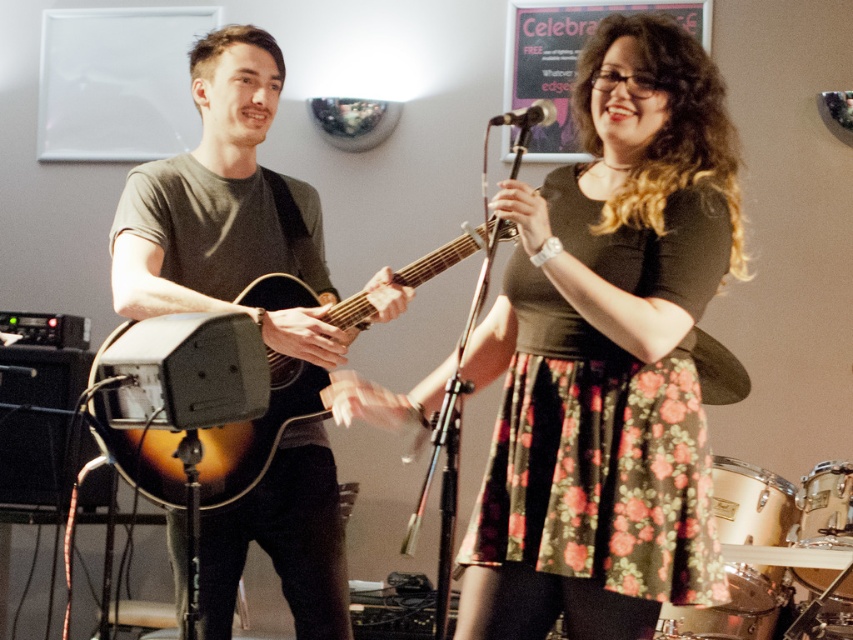
You are a photographer at the event and want to capture a shot that includes both the floral skirt at center and the metallic silver microphone at upper center. Based on their positions, which object should you place closer to the left side of your camera frame?

The metallic silver microphone at upper center should be placed closer to the left side of your camera frame because the floral skirt at center is positioned on the right side of it.

You are a stagehand setting up equipment for a performance. You have a sunburst wood acoustic guitar at center and a metallic silver microphone at upper center. Which object is wider?

The sunburst wood acoustic guitar at center is wider than the metallic silver microphone at upper center.